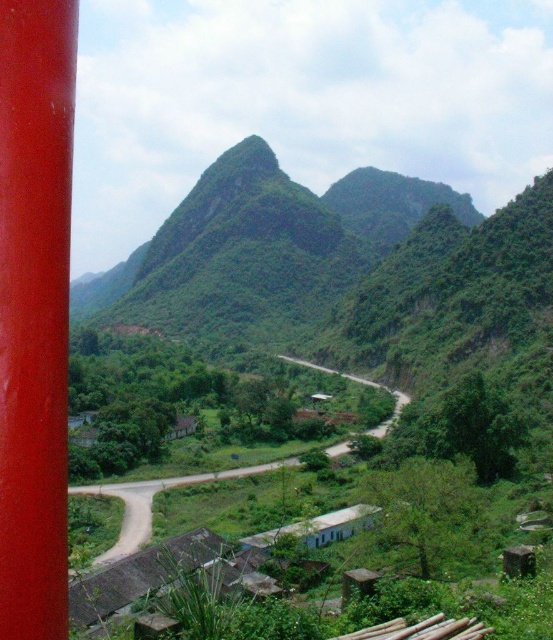
Question: Does glossy red pole at left have a larger size compared to green grassy road at center?

Choices:
 (A) yes
 (B) no

Answer: (B)

Question: Which point is closer to the camera taking this photo?

Choices:
 (A) (62, 388)
 (B) (129, 513)

Answer: (A)

Question: Can you confirm if glossy red pole at left is positioned above green grassy road at center?

Choices:
 (A) yes
 (B) no

Answer: (A)

Question: Can you confirm if glossy red pole at left is wider than green grassy road at center?

Choices:
 (A) yes
 (B) no

Answer: (B)